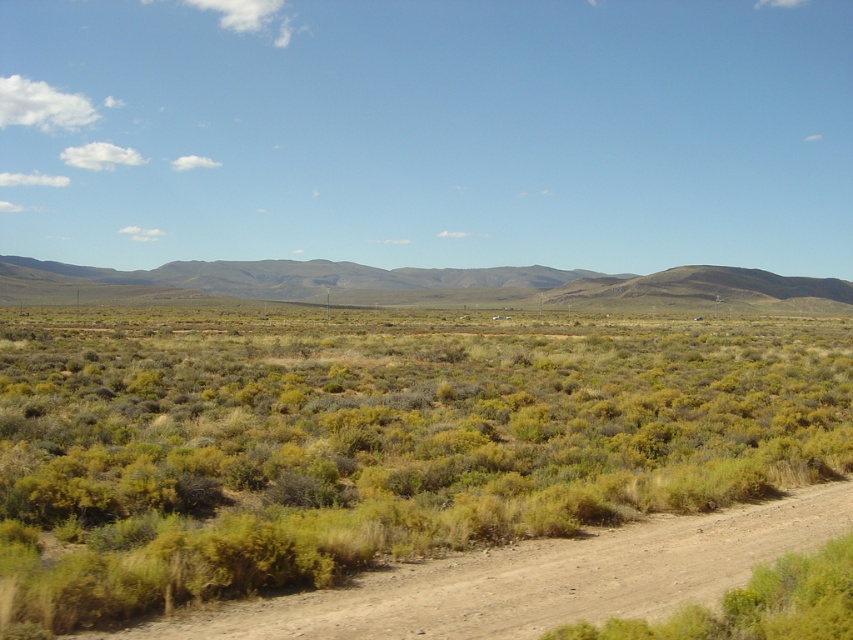
You are standing at the edge of the scene and want to walk towards the brown dirt track at lower center. Will you have to walk past the green shrubbery at center first?

Yes, you will have to walk past the green shrubbery at center first because it is closer to you than the brown dirt track at lower center.